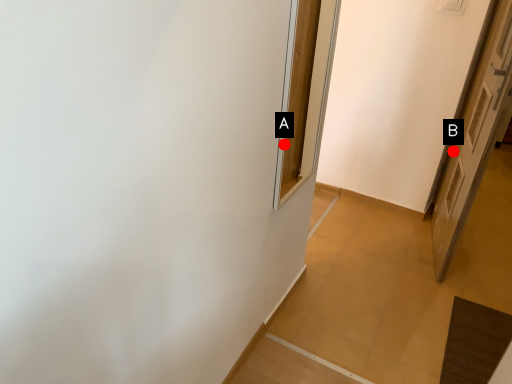
Question: Two points are circled on the image, labeled by A and B beside each circle. Among these points, which one is nearest to the camera?

Choices:
 (A) A is closer
 (B) B is closer

Answer: (A)